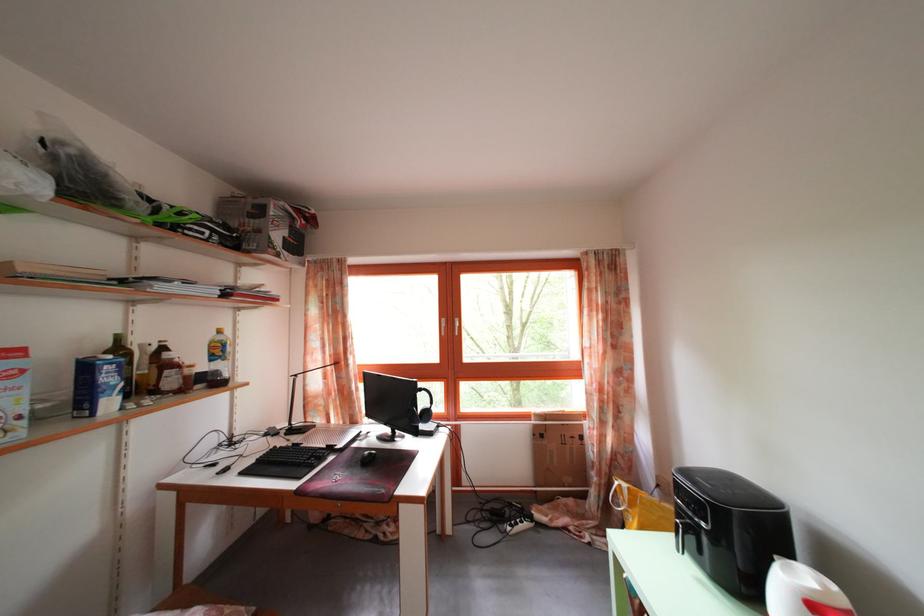
Find where to lift the brown plastic bottle. Please return your answer as a coordinate pair (x, y).

(123, 362)